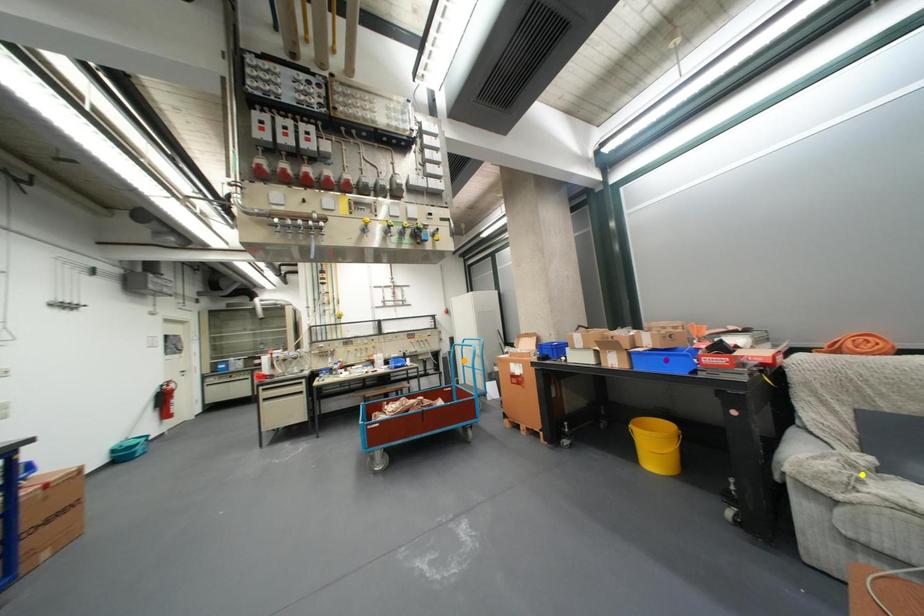
Order these from nearest to farthest:
A) orange point
B) yellow point
C) purple point

orange point < purple point < yellow point